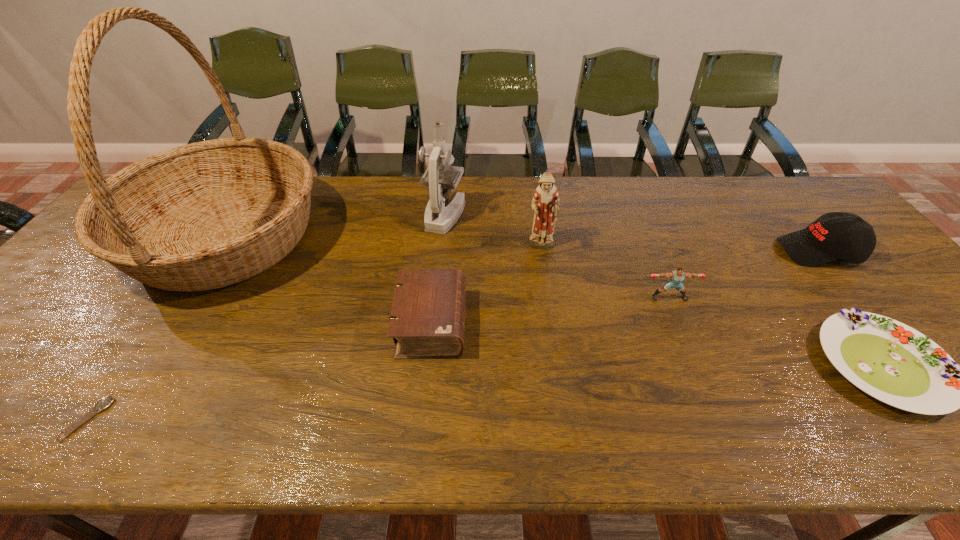
The height and width of the screenshot is (540, 960). Find the location of `basket`. basket is located at coordinates (206, 215).

At what (x,y) coordinates should I click in order to perform the action: click on microscope. Please return your answer as a coordinate pair (x, y). This screenshot has height=540, width=960. Looking at the image, I should click on (439, 219).

Identify the location of the fourth object from right to left. The height and width of the screenshot is (540, 960). (545, 205).

In order to click on the third tallest object in this screenshot , I will do `click(545, 205)`.

This screenshot has width=960, height=540. Identify the location of baseball cap. tap(843, 236).

Find the location of a particular element. The width and height of the screenshot is (960, 540). puncher is located at coordinates (676, 277).

The height and width of the screenshot is (540, 960). What are the coordinates of `the fourth shortest object` in the screenshot? It's located at (676, 277).

At what (x,y) coordinates should I click in order to perform the action: click on Bible. Please return your answer as a coordinate pair (x, y). Looking at the image, I should click on click(x=427, y=320).

Where is `the shortest object`? The image size is (960, 540). the shortest object is located at coordinates (105, 402).

At what (x,y) coordinates should I click in order to perform the action: click on free region located 0.260m on the right of the tallest object. Please return your answer as a coordinate pair (x, y). Looking at the image, I should click on (412, 238).